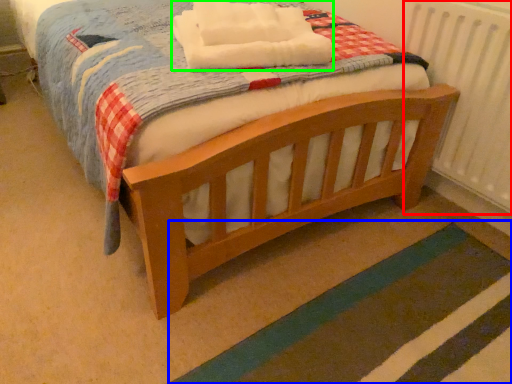
Question: Estimate the real-world distances between objects in this image. Which object is farther from radiator (highlighted by a red box), strip (highlighted by a blue box) or blanket (highlighted by a green box)?

Choices:
 (A) strip
 (B) blanket

Answer: (B)